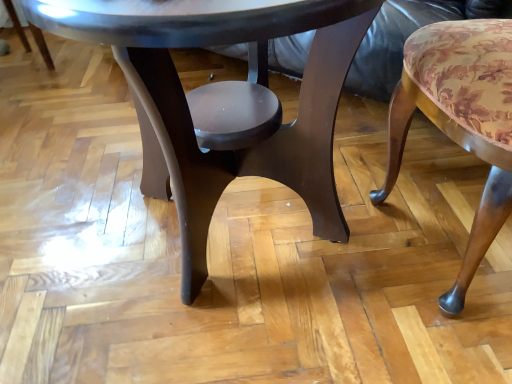
The height and width of the screenshot is (384, 512). Describe the element at coordinates (460, 119) in the screenshot. I see `floral fabric cushion at right` at that location.

Image resolution: width=512 pixels, height=384 pixels. Find the location of `floral fabric cushion at right`. floral fabric cushion at right is located at coordinates (460, 119).

This screenshot has height=384, width=512. What do you see at coordinates (188, 107) in the screenshot?
I see `glossy dark wood coffee table at center` at bounding box center [188, 107].

The width and height of the screenshot is (512, 384). Find the location of `glossy dark wood coffee table at center`. glossy dark wood coffee table at center is located at coordinates (188, 107).

This screenshot has height=384, width=512. Find the location of `floral fabric cushion at right`. floral fabric cushion at right is located at coordinates [460, 119].

Between floral fabric cushion at right and glossy dark wood coffee table at center, which one appears on the right side from the viewer's perspective?

floral fabric cushion at right.

Considering their positions, is floral fabric cushion at right located in front of or behind glossy dark wood coffee table at center?

floral fabric cushion at right is behind glossy dark wood coffee table at center.

Is point (480, 220) more distant than point (311, 134)?

No, (480, 220) is in front of (311, 134).

From the image's perspective, which is above, floral fabric cushion at right or glossy dark wood coffee table at center?

glossy dark wood coffee table at center appears higher in the image.

From a real-world perspective, who is located higher, floral fabric cushion at right or glossy dark wood coffee table at center?

glossy dark wood coffee table at center, from a real-world perspective.

Is floral fabric cushion at right wider than glossy dark wood coffee table at center?

Incorrect, the width of floral fabric cushion at right does not surpass that of glossy dark wood coffee table at center.

Consider the image. Who is shorter, floral fabric cushion at right or glossy dark wood coffee table at center?

floral fabric cushion at right.

Considering the sizes of objects floral fabric cushion at right and glossy dark wood coffee table at center in the image provided, who is smaller, floral fabric cushion at right or glossy dark wood coffee table at center?

floral fabric cushion at right is smaller.

Do you think floral fabric cushion at right is within glossy dark wood coffee table at center, or outside of it?

floral fabric cushion at right is not inside glossy dark wood coffee table at center, it's outside.

Is floral fabric cushion at right positioned far away from glossy dark wood coffee table at center?

No, floral fabric cushion at right is not far from glossy dark wood coffee table at center.

Does floral fabric cushion at right turn towards glossy dark wood coffee table at center?

Yes, floral fabric cushion at right faces towards glossy dark wood coffee table at center.

In the scene shown: How different are the orientations of floral fabric cushion at right and glossy dark wood coffee table at center in degrees?

40.1 degrees.

How distant is floral fabric cushion at right from glossy dark wood coffee table at center?

A distance of 27.39 centimeters exists between floral fabric cushion at right and glossy dark wood coffee table at center.

This screenshot has height=384, width=512. What are the coordinates of `chair on the right side of glossy dark wood coffee table at center` in the screenshot? It's located at (460, 119).

Which is more to the right, glossy dark wood coffee table at center or floral fabric cushion at right?

Positioned to the right is floral fabric cushion at right.

Which is in front, glossy dark wood coffee table at center or floral fabric cushion at right?

glossy dark wood coffee table at center is closer to the camera.

Which is in front, point (257, 52) or point (467, 129)?

Positioned in front is point (467, 129).

From the image's perspective, which is below, glossy dark wood coffee table at center or floral fabric cushion at right?

floral fabric cushion at right, from the image's perspective.

From a real-world perspective, between glossy dark wood coffee table at center and floral fabric cushion at right, who is vertically lower?

From a 3D spatial view, floral fabric cushion at right is below.

Which object is wider, glossy dark wood coffee table at center or floral fabric cushion at right?

glossy dark wood coffee table at center.

Looking at this image, who is taller, glossy dark wood coffee table at center or floral fabric cushion at right?

glossy dark wood coffee table at center.

Considering the sizes of objects glossy dark wood coffee table at center and floral fabric cushion at right in the image provided, who is smaller, glossy dark wood coffee table at center or floral fabric cushion at right?

Smaller between the two is floral fabric cushion at right.

Could floral fabric cushion at right be considered to be inside glossy dark wood coffee table at center?

No, floral fabric cushion at right is not surrounded by glossy dark wood coffee table at center.

Is glossy dark wood coffee table at center beside floral fabric cushion at right?

There is a gap between glossy dark wood coffee table at center and floral fabric cushion at right.

Is floral fabric cushion at right at the back of glossy dark wood coffee table at center?

No, glossy dark wood coffee table at center is not facing the opposite direction of floral fabric cushion at right.

This screenshot has width=512, height=384. In order to click on coffee table that appears above the floral fabric cushion at right (from a real-world perspective) in this screenshot , I will do `click(188, 107)`.

There is a floral fabric cushion at right. Identify the location of coffee table above it (from a real-world perspective). This screenshot has height=384, width=512. (188, 107).

Identify the location of chair below the glossy dark wood coffee table at center (from a real-world perspective). (460, 119).